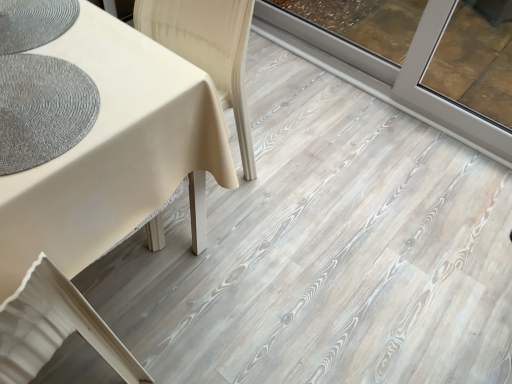
Locate an element on the screen. vacant area on top of textured gray mat at left (from a real-world perspective) is located at coordinates (33, 93).